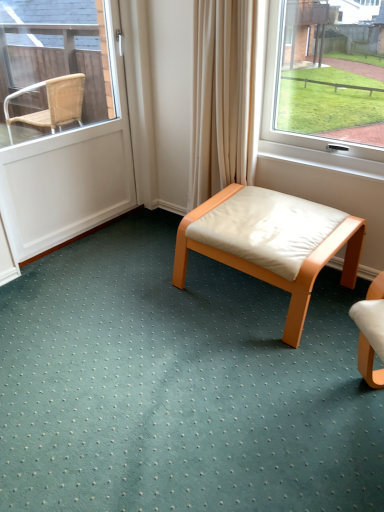
At what (x,y) coordinates should I click in order to perform the action: click on free point in front of light brown wood stool at center. Please return your answer as a coordinate pair (x, y). The image size is (384, 512). Looking at the image, I should click on (259, 378).